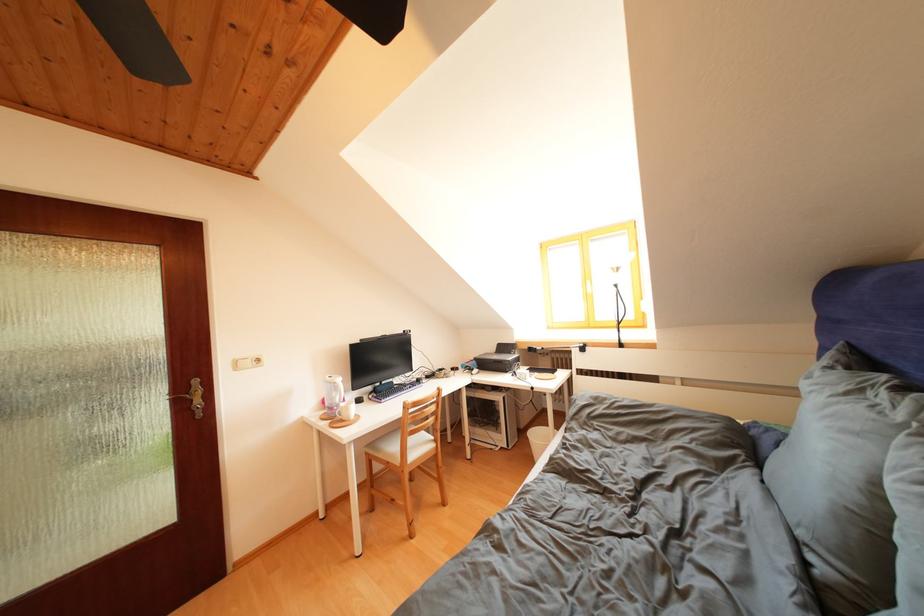
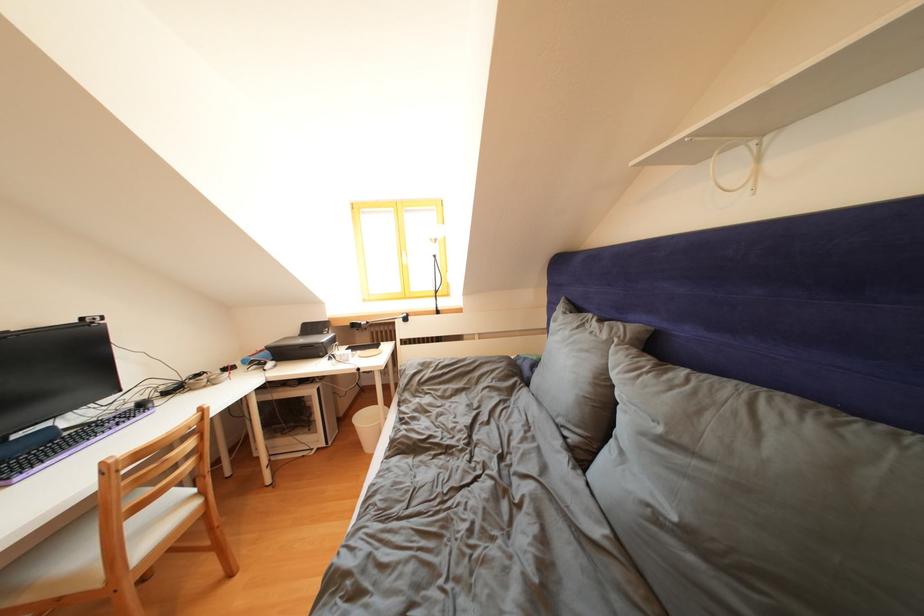
Locate, in the second image, the point that corresponds to the point at 430,450 in the first image.

(175, 522)